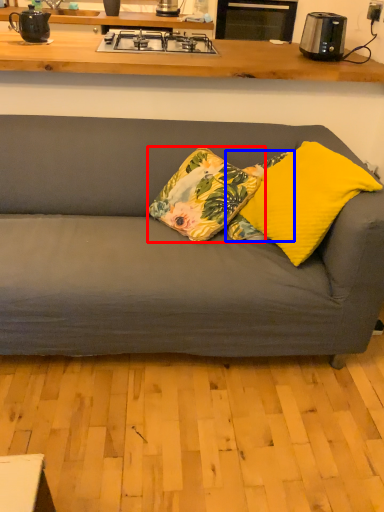
Question: Which point is further to the camera, pillow (highlighted by a red box) or pillow (highlighted by a blue box)?

Choices:
 (A) pillow
 (B) pillow

Answer: (B)